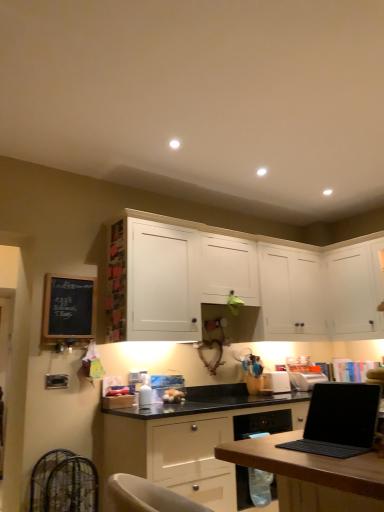
Question: Should I look upward or downward to see white matte cabinet at center, the 1th cabinetry in the top-to-bottom sequence?

Choices:
 (A) down
 (B) up

Answer: (A)

Question: Is white matte cabinet at upper right, which is the 2th cabinetry in top-to-bottom order, not close to black matte laptop at lower right?

Choices:
 (A) no
 (B) yes

Answer: (B)

Question: Is white matte cabinet at upper right, placed as the 2th cabinetry when sorted from bottom to top, touching black matte laptop at lower right?

Choices:
 (A) no
 (B) yes

Answer: (A)

Question: Does white matte cabinet at upper right, which is the 2th cabinetry in top-to-bottom order, have a lesser width compared to black matte laptop at lower right?

Choices:
 (A) yes
 (B) no

Answer: (B)

Question: Can you confirm if white matte cabinet at upper right, which is the 2th cabinetry in top-to-bottom order, is shorter than black matte laptop at lower right?

Choices:
 (A) no
 (B) yes

Answer: (A)

Question: Considering the relative sizes of white matte cabinet at upper right, placed as the 2th cabinetry when sorted from bottom to top, and black matte laptop at lower right in the image provided, is white matte cabinet at upper right, placed as the 2th cabinetry when sorted from bottom to top, bigger than black matte laptop at lower right?

Choices:
 (A) yes
 (B) no

Answer: (A)

Question: From the image's perspective, is white matte cabinet at upper right, which is the 2th cabinetry in top-to-bottom order, located above black matte laptop at lower right?

Choices:
 (A) no
 (B) yes

Answer: (B)

Question: Does matte white cabinet at center, acting as the 3th cabinetry starting from the top, turn towards white matte cabinet at center, the 1th cabinetry in the top-to-bottom sequence?

Choices:
 (A) no
 (B) yes

Answer: (A)

Question: Is matte white cabinet at center, the 1th cabinetry positioned from the bottom, looking in the opposite direction of white matte cabinet at center, the third cabinetry from the bottom?

Choices:
 (A) yes
 (B) no

Answer: (B)

Question: Is matte white cabinet at center, acting as the 3th cabinetry starting from the top, to the left of white matte cabinet at center, the third cabinetry from the bottom, from the viewer's perspective?

Choices:
 (A) yes
 (B) no

Answer: (B)

Question: Is matte white cabinet at center, acting as the 3th cabinetry starting from the top, placed right next to white matte cabinet at center, the third cabinetry from the bottom?

Choices:
 (A) no
 (B) yes

Answer: (A)

Question: Is matte white cabinet at center, acting as the 3th cabinetry starting from the top, not near white matte cabinet at center, the third cabinetry from the bottom?

Choices:
 (A) no
 (B) yes

Answer: (B)

Question: Considering the relative sizes of matte white cabinet at center, the 1th cabinetry positioned from the bottom, and white matte cabinet at center, the third cabinetry from the bottom, in the image provided, is matte white cabinet at center, the 1th cabinetry positioned from the bottom, bigger than white matte cabinet at center, the third cabinetry from the bottom,?

Choices:
 (A) no
 (B) yes

Answer: (B)

Question: Is black chalkboard at left completely or partially inside matte white cabinet at center, the 1th cabinetry positioned from the bottom?

Choices:
 (A) no
 (B) yes

Answer: (A)